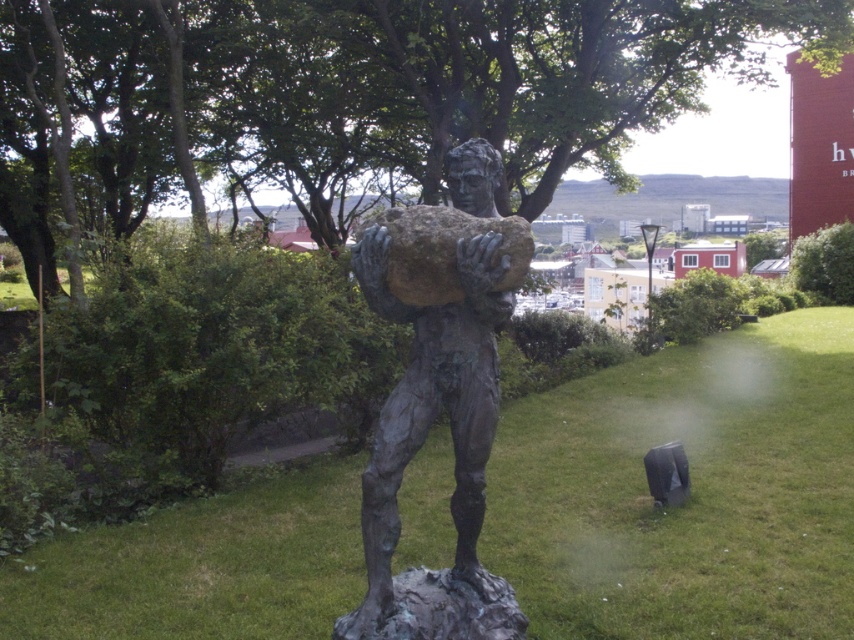
Consider the image. You are a photographer planning to take a picture of the bronze statue at center. You want to ensure the green grass at center is visible in the background. Based on their heights, is this possible?

The green grass at center is not as tall as the bronze statue at center, so the grass will be visible behind the statue in the photo.

You are planning to place a new bench in the image. The bench is 1.5 meters wide. You want to place it either on the green grass at center or next to the bronze statue at center. Based on the width of the areas, which location has enough space for the bench?

The green grass at center has a greater width than the bronze statue at center, so placing the bench on the green grass at center would provide sufficient space for the 1.5 meter wide bench.

You are a photographer wanting to capture the bronze statue at center and the green grass at center in a single shot. Since you want the statue to be in focus, which object should you position closer to the camera?

The bronze statue at center is behind green grass at center, so to have it in focus, you should position the bronze statue at center closer to the camera.